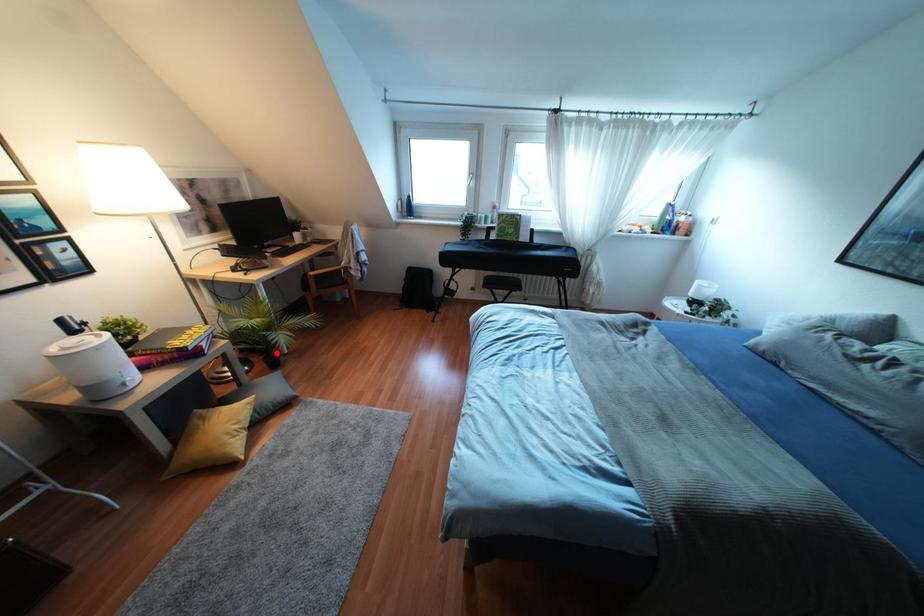
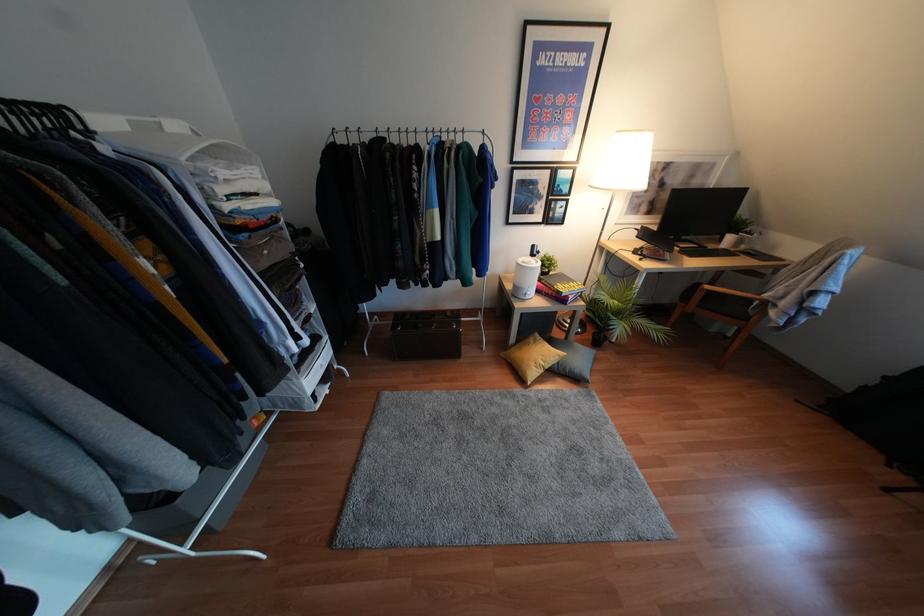
Question: I am providing you with two images of the same scene from different viewpoints. Given a red point in image1, look at the same physical point in image2. Is it:

Choices:
 (A) Closer to the viewpoint
 (B) Farther from the viewpoint

Answer: (B)